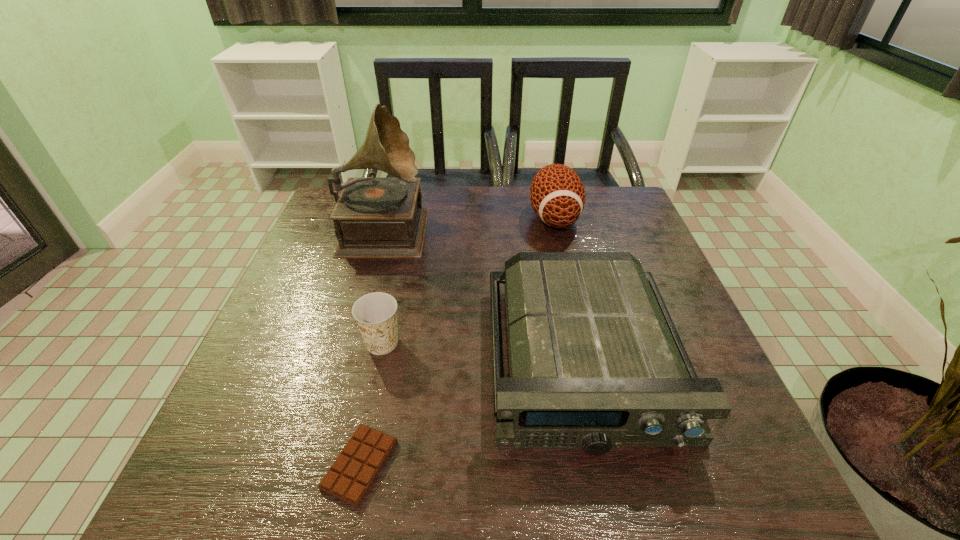
Where is `record player`? The width and height of the screenshot is (960, 540). record player is located at coordinates (374, 217).

Where is `the fourth shortest object`? the fourth shortest object is located at coordinates (557, 195).

Where is `radio receiver`? The image size is (960, 540). radio receiver is located at coordinates (596, 363).

At what (x,y) coordinates should I click in order to perform the action: click on Dixie cup. Please return your answer as a coordinate pair (x, y). Image resolution: width=960 pixels, height=540 pixels. Looking at the image, I should click on (375, 313).

Locate an element on the screen. The image size is (960, 540). candy bar is located at coordinates (350, 477).

This screenshot has width=960, height=540. What are the coordinates of `free space located 0.260m from the horn of the tallest object` in the screenshot? It's located at (518, 227).

The width and height of the screenshot is (960, 540). Identify the location of free location located 0.230m on the left of the fourth shortest object. (449, 218).

At what (x,y) coordinates should I click in order to perform the action: click on vacant point located on the front panel of the radio receiver. Please return your answer as a coordinate pair (x, y). This screenshot has width=960, height=540. Looking at the image, I should click on (613, 496).

This screenshot has width=960, height=540. Identify the location of free space located on the right of the Dixie cup. (431, 343).

Image resolution: width=960 pixels, height=540 pixels. What are the coordinates of `vacant area located on the back of the shortest object` in the screenshot? It's located at (394, 304).